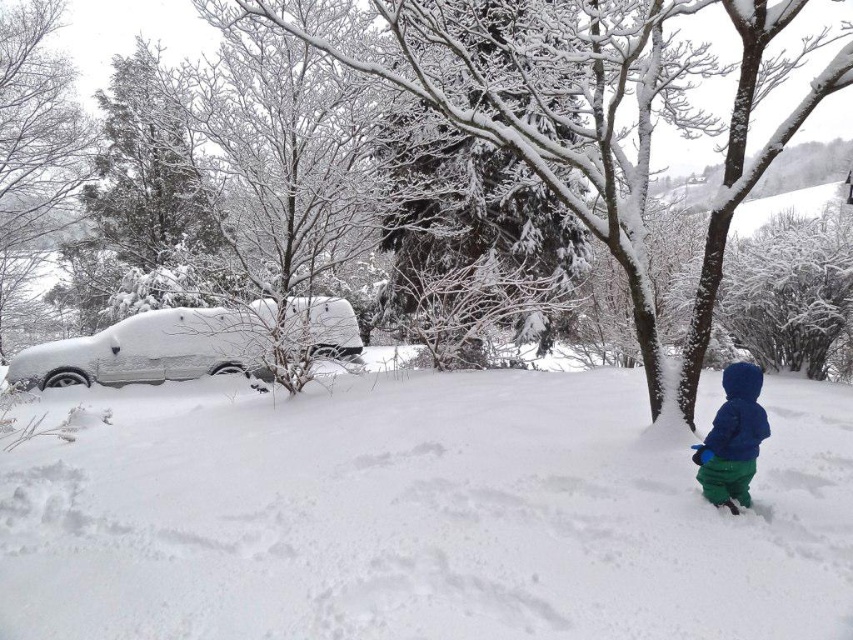
Is snow-covered car at left above blue fleece jacket at lower right?

Yes.

Is point (326, 320) positioned after point (737, 397)?

Yes, point (326, 320) is behind point (737, 397).

Locate an element on the screen. snow-covered car at left is located at coordinates (149, 349).

Locate an element on the screen. This screenshot has width=853, height=640. snow-covered car at left is located at coordinates click(149, 349).

This screenshot has width=853, height=640. What do you see at coordinates (421, 516) in the screenshot?
I see `white fluffy snow at lower left` at bounding box center [421, 516].

Does white fluffy snow at lower left have a lesser height compared to snow-covered car at left?

Incorrect, white fluffy snow at lower left's height does not fall short of snow-covered car at left's.

Does point (776, 612) come behind point (236, 342)?

No, it is in front of (236, 342).

The height and width of the screenshot is (640, 853). I want to click on white fluffy snow at lower left, so click(421, 516).

Is white fluffy snow at lower left below blue fleece jacket at lower right?

Yes, white fluffy snow at lower left is below blue fleece jacket at lower right.

Who is more distant from viewer, (424, 614) or (758, 384)?

Positioned behind is point (758, 384).

What do you see at coordinates (421, 516) in the screenshot? I see `white fluffy snow at lower left` at bounding box center [421, 516].

You are a GUI agent. You are given a task and a screenshot of the screen. Output one action in this format:
    pyautogui.click(x=<x>, y=<y>)
    Task: Click on the white fluffy snow at lower left
    Image resolution: width=853 pixels, height=640 pixels.
    Given the screenshot: What is the action you would take?
    pyautogui.click(x=421, y=516)